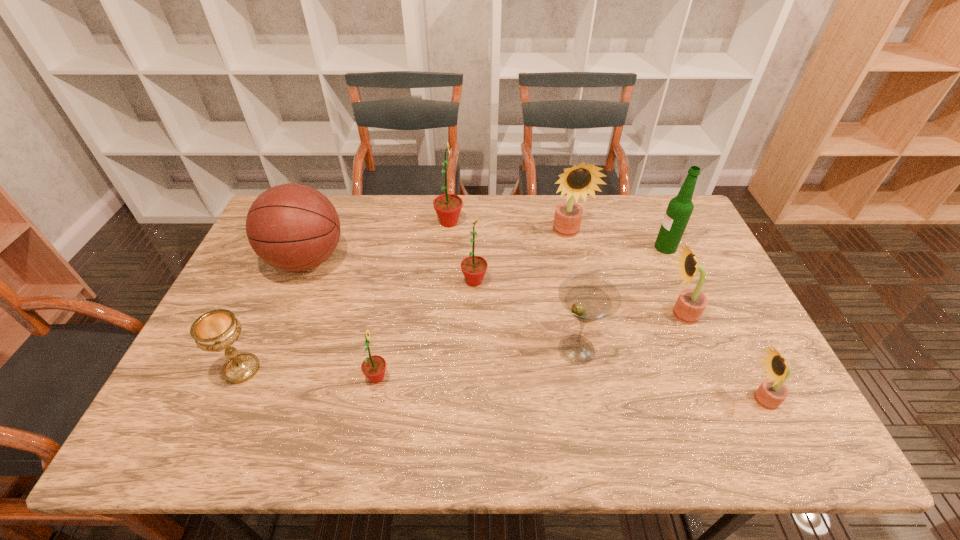
Locate an element on the screen. This screenshot has height=540, width=960. the second green sunflower from left to right is located at coordinates (447, 206).

I want to click on the biggest green sunflower, so click(447, 206).

At what (x,y) coordinates should I click in order to perform the action: click on the farthest yellow sunflower. Please return your answer as a coordinate pair (x, y). This screenshot has height=540, width=960. Looking at the image, I should click on (579, 180).

You are a GUI agent. You are given a task and a screenshot of the screen. Output one action in this format:
    pyautogui.click(x=<x>, y=<y>)
    Task: Click on the biggest yellow sunflower
    The height and width of the screenshot is (540, 960).
    Given the screenshot: What is the action you would take?
    pyautogui.click(x=579, y=180)

The height and width of the screenshot is (540, 960). I want to click on green beer bottle, so click(679, 210).

You are a GUI agent. You are given a task and a screenshot of the screen. Output one action in this format:
    pyautogui.click(x=<x>, y=<y>)
    Task: Click on the basketball
    The width and height of the screenshot is (960, 540).
    Given the screenshot: What is the action you would take?
    pyautogui.click(x=293, y=227)

You are a GUI agent. You are given a task and a screenshot of the screen. Output one action in this format:
    pyautogui.click(x=<x>, y=<y>)
    Task: Click on the second smallest yellow sunflower
    The width and height of the screenshot is (960, 540).
    Given the screenshot: What is the action you would take?
    pyautogui.click(x=690, y=305)

Locate an element on the screen. The image size is (960, 540). the second yellow sunflower from left to right is located at coordinates (690, 305).

The image size is (960, 540). In order to click on the second farthest green sunflower in this screenshot , I will do `click(474, 268)`.

Identify the location of the third sunflower from left to right. This screenshot has height=540, width=960. pyautogui.click(x=474, y=268).